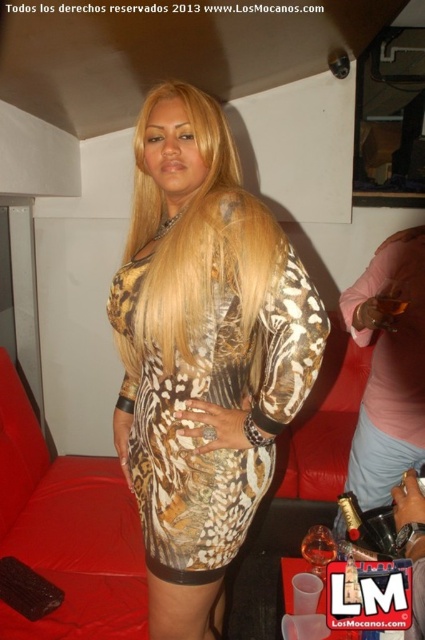
Does leopard print dress at center have a greater width compared to blondehair at center?

Correct, the width of leopard print dress at center exceeds that of blondehair at center.

Can you confirm if leopard print dress at center is positioned to the left of blondehair at center?

In fact, leopard print dress at center is to the right of blondehair at center.

Locate an element on the screen. The width and height of the screenshot is (425, 640). leopard print dress at center is located at coordinates (203, 355).

Is leopard print dress at center to the right of metallic gold ring at center from the viewer's perspective?

In fact, leopard print dress at center is to the left of metallic gold ring at center.

Find the location of a particular element. The width and height of the screenshot is (425, 640). leopard print dress at center is located at coordinates click(203, 355).

At what (x,y) coordinates should I click in order to perform the action: click on leopard print dress at center. Please return your answer as a coordinate pair (x, y). This screenshot has width=425, height=640. Looking at the image, I should click on (203, 355).

Identify the location of metallic gold bracelet at upper right. (388, 368).

Does point (408, 275) come farther from viewer compared to point (388, 458)?

That is False.

Between point (351, 289) and point (397, 451), which one is positioned behind?

Positioned behind is point (351, 289).

Identify the location of metallic gold bracelet at upper right. (388, 368).